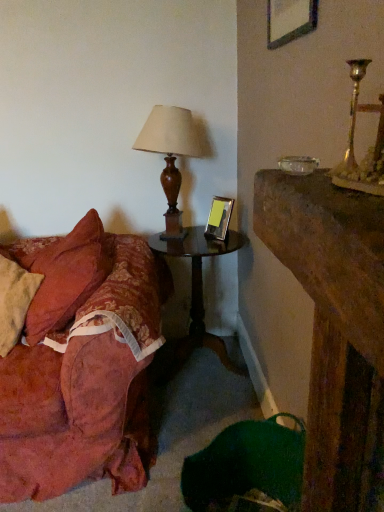
Question: In the image, is wooden picture frame at upper center, arranged as the first picture frame when viewed from the front, on the left side or the right side of metallic silver picture frame at center, the 2th picture frame from the front?

Choices:
 (A) left
 (B) right

Answer: (B)

Question: From their relative heights in the image, would you say wooden picture frame at upper center, placed as the 2th picture frame when sorted from back to front, is taller or shorter than metallic silver picture frame at center, which is the first picture frame from left to right?

Choices:
 (A) short
 (B) tall

Answer: (A)

Question: Which of these objects is positioned closest to the floral fabric couch at left?

Choices:
 (A) metallic silver picture frame at center, which is the first picture frame from left to right
 (B) wooden lampshade at left
 (C) gold metallic candle holder at upper right
 (D) wooden dark brown side table at center
 (E) wooden picture frame at upper center, which is counted as the second picture frame, starting from the left

Answer: (D)

Question: Which object is the farthest from the wooden picture frame at upper center, arranged as the first picture frame when viewed from the front?

Choices:
 (A) wooden lampshade at left
 (B) metallic silver picture frame at center, placed as the 1th picture frame when sorted from back to front
 (C) floral fabric couch at left
 (D) wooden dark brown side table at center
 (E) gold metallic candle holder at upper right

Answer: (C)